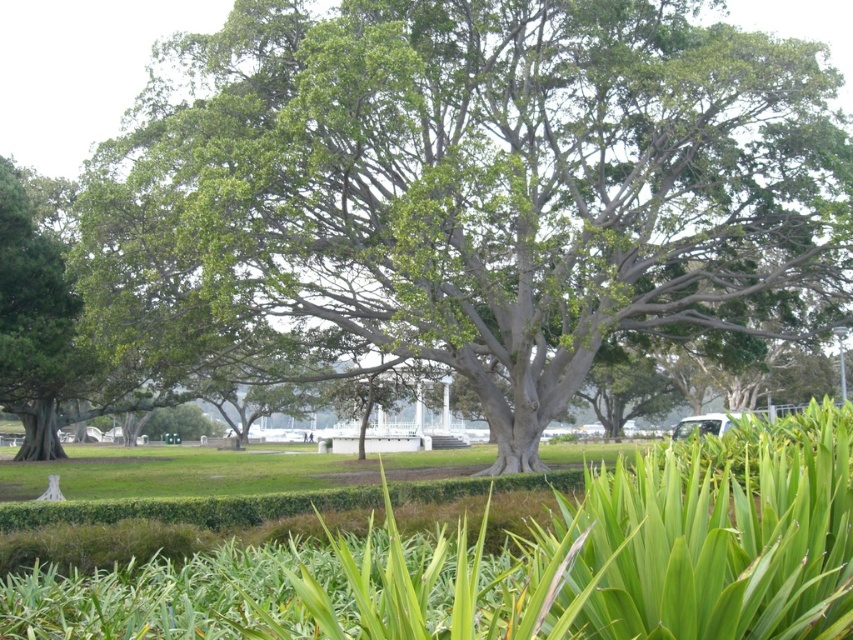
Which is in front, point (585, 145) or point (343, 563)?

Point (343, 563) is more forward.

Can you confirm if green leafy tree at center is bigger than green leafy grass at center?

Yes, green leafy tree at center is bigger than green leafy grass at center.

Which is in front, point (247, 188) or point (643, 547)?

Point (643, 547)

This screenshot has width=853, height=640. In order to click on green leafy tree at center in this screenshot , I will do `click(490, 186)`.